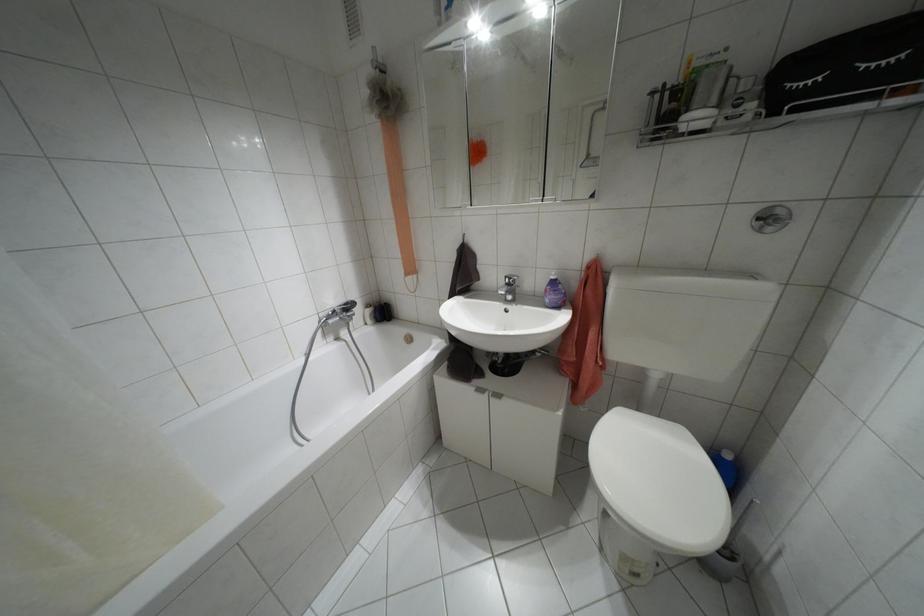
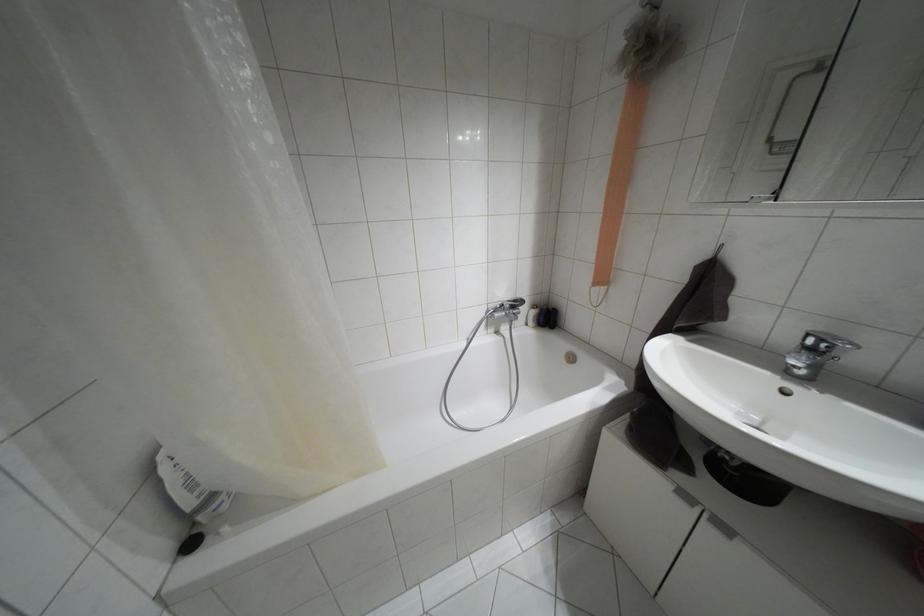
Where in the second image is the point corresponding to pixel 505 277 from the first image?

(808, 334)